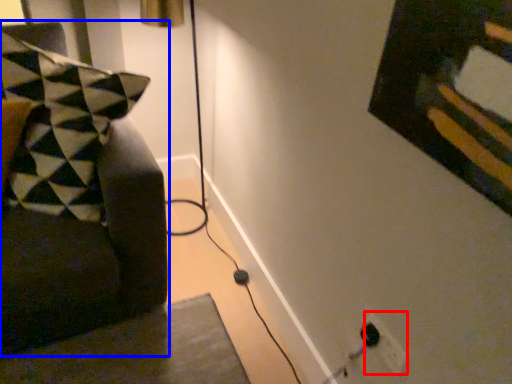
Question: Which object appears farthest to the camera in this image, electric outlet (highlighted by a red box) or furniture (highlighted by a blue box)?

Choices:
 (A) electric outlet
 (B) furniture

Answer: (A)